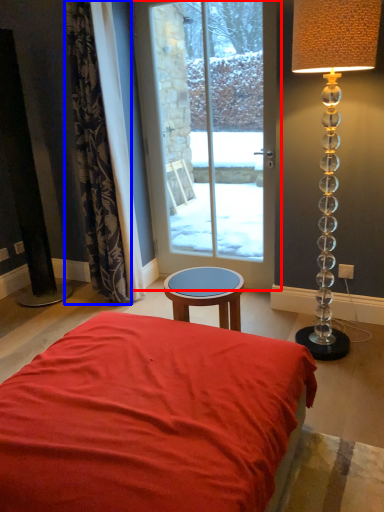
Question: Among these objects, which one is farthest to the camera, door (highlighted by a red box) or curtain (highlighted by a blue box)?

Choices:
 (A) door
 (B) curtain

Answer: (A)